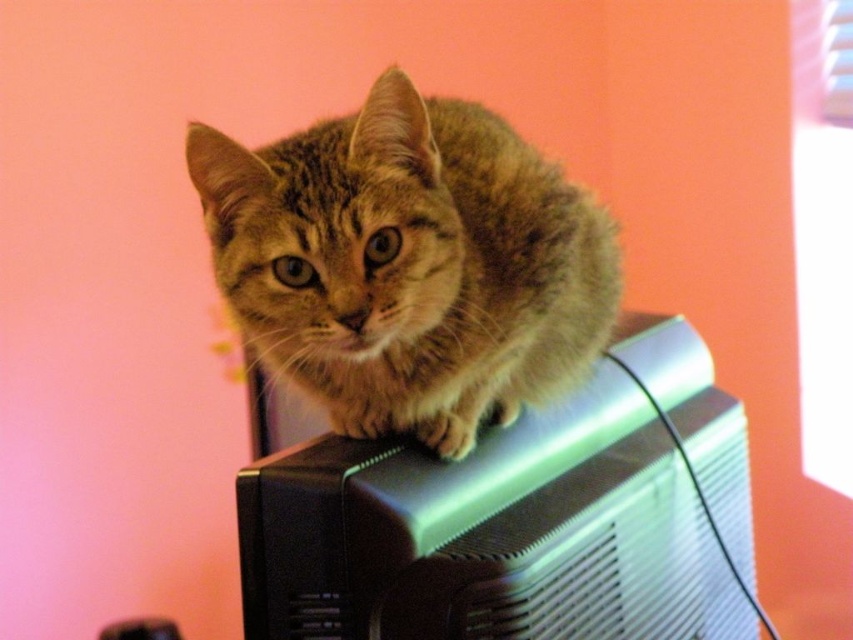
Who is taller, metallic silver computer at upper center or fuzzy brown cat at center?

metallic silver computer at upper center

Between metallic silver computer at upper center and fuzzy brown cat at center, which one appears on the left side from the viewer's perspective?

fuzzy brown cat at center

Locate an element on the screen. This screenshot has height=640, width=853. metallic silver computer at upper center is located at coordinates pos(519,518).